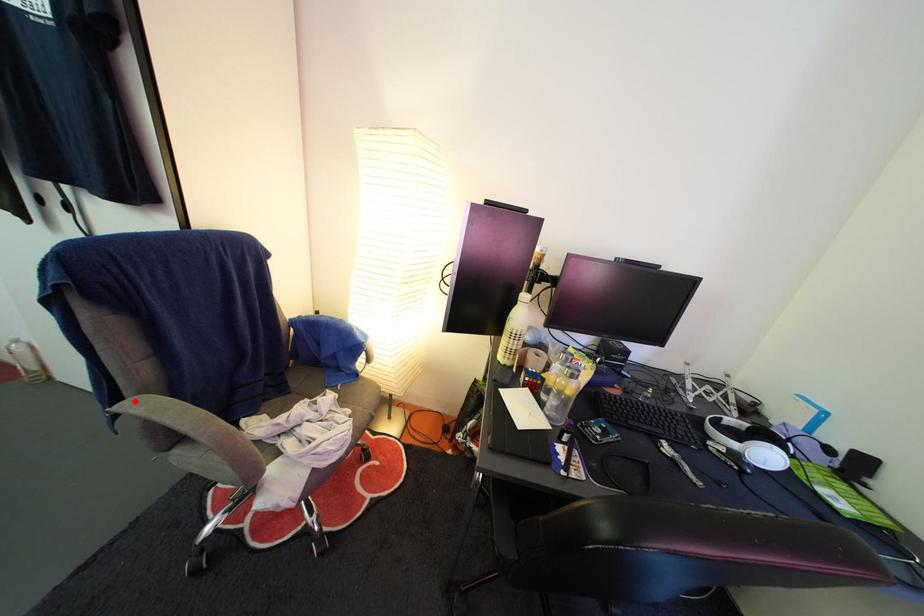
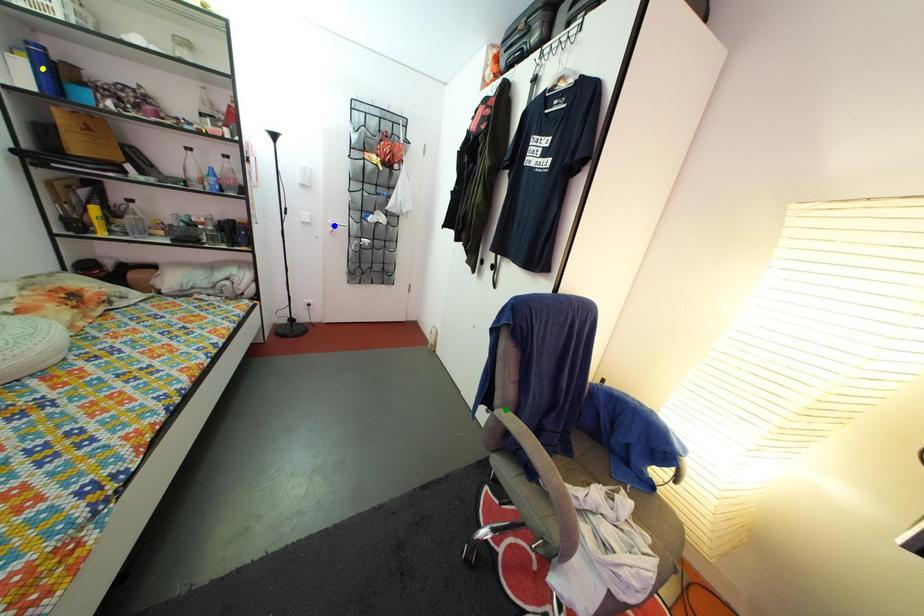
Question: I am providing you with two images of the same scene from different viewpoints. A red point is marked on the first image. You are given multiple points on the second image. Which point in image 2 is actually the same real-world point as the red point in image 1?

Choices:
 (A) blue point
 (B) green point
 (C) yellow point

Answer: (B)